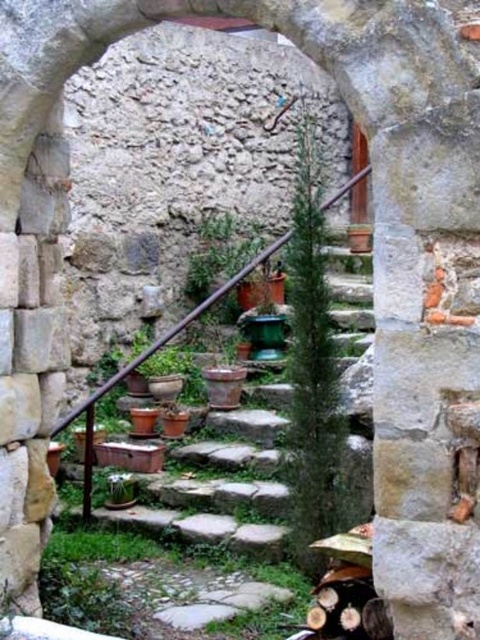
Question: Can you confirm if green textured plant at center is smaller than green matte plant at center?

Choices:
 (A) no
 (B) yes

Answer: (A)

Question: Does green textured plant at center appear on the left side of green matte plant at center?

Choices:
 (A) yes
 (B) no

Answer: (B)

Question: Which point is closer to the camera taking this photo?

Choices:
 (A) (236, 250)
 (B) (311, 150)

Answer: (A)

Question: Which of the following is the closest to the observer?

Choices:
 (A) (345, 189)
 (B) (203, 291)

Answer: (A)

Question: Is green textured plant at center above green matte plant at center?

Choices:
 (A) no
 (B) yes

Answer: (A)